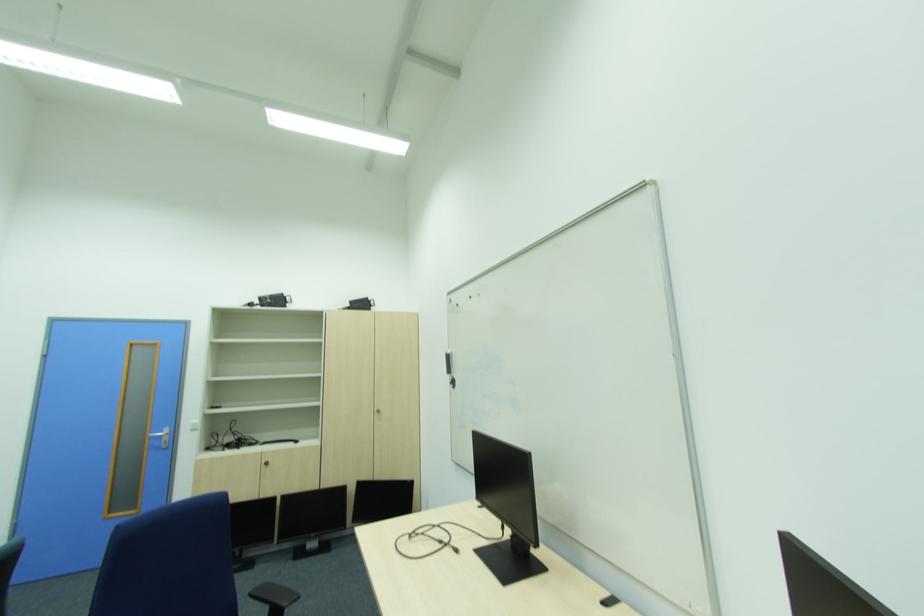
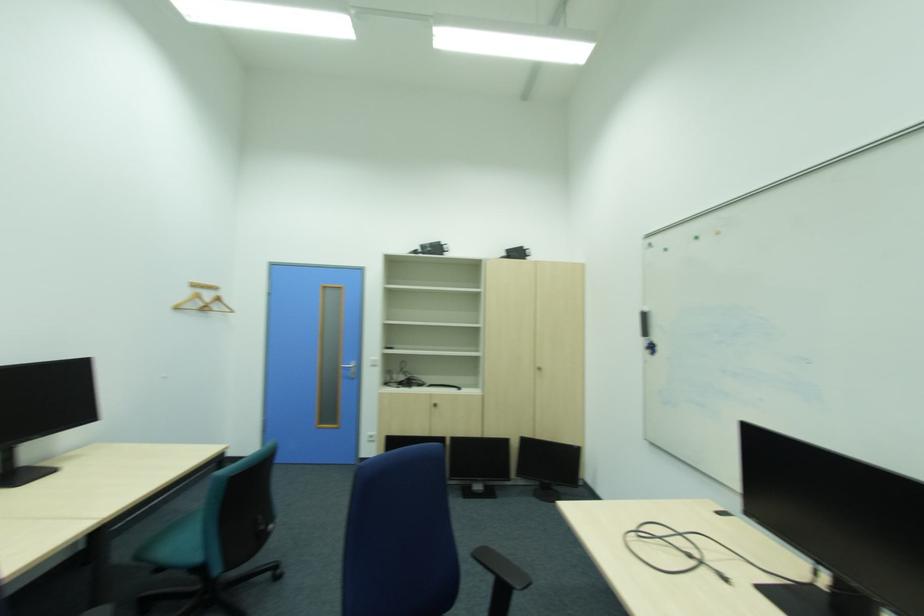
Question: The camera is either moving clockwise (left) or counter-clockwise (right) around the object. The first image is from the beginning of the video and the second image is from the end. Is the camera moving left or right when shooting the video?

Choices:
 (A) Left
 (B) Right

Answer: (B)